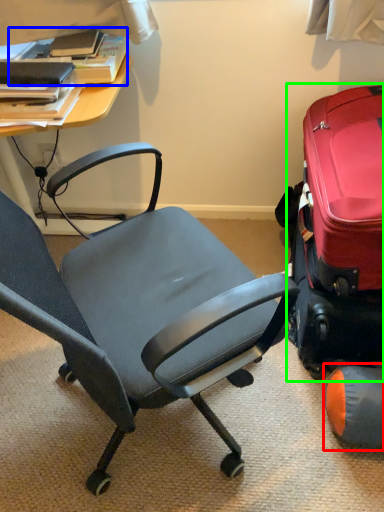
Question: Estimate the real-world distances between objects in this image. Which object is closer to bean bag chair (highlighted by a red box), book (highlighted by a blue box) or suitcase (highlighted by a green box)?

Choices:
 (A) book
 (B) suitcase

Answer: (B)